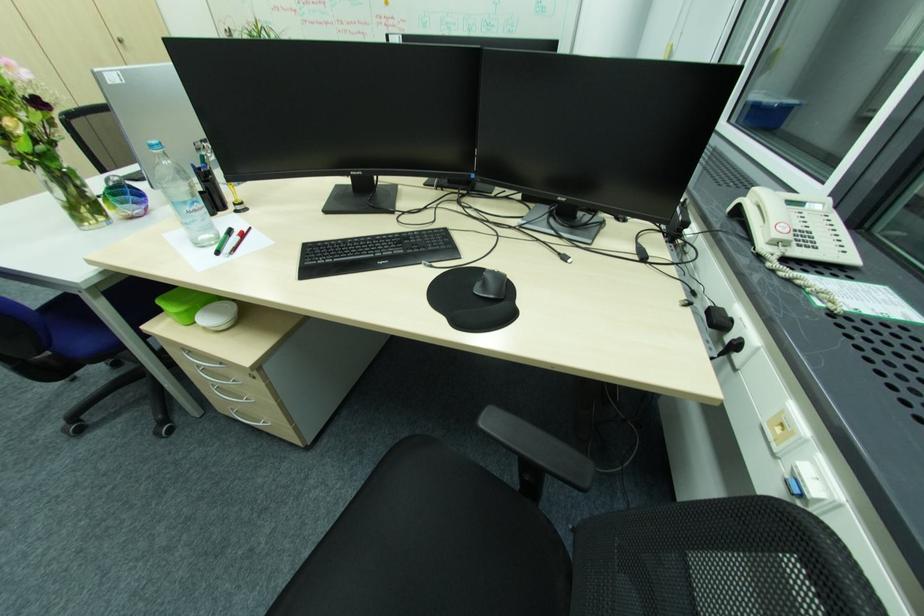
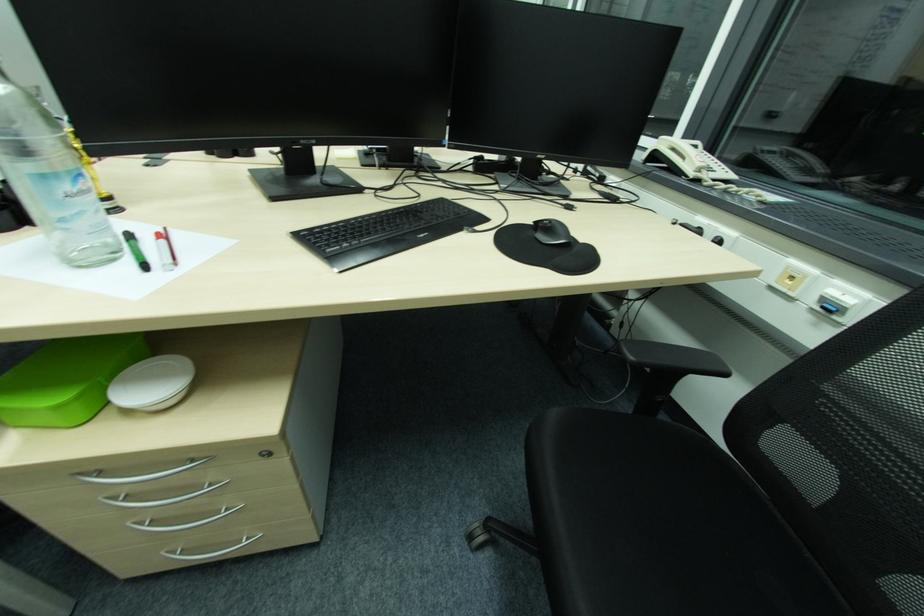
Question: The camera is either moving clockwise (left) or counter-clockwise (right) around the object. The first image is from the beginning of the video and the second image is from the end. Is the camera moving left or right when shooting the video?

Choices:
 (A) Left
 (B) Right

Answer: (A)